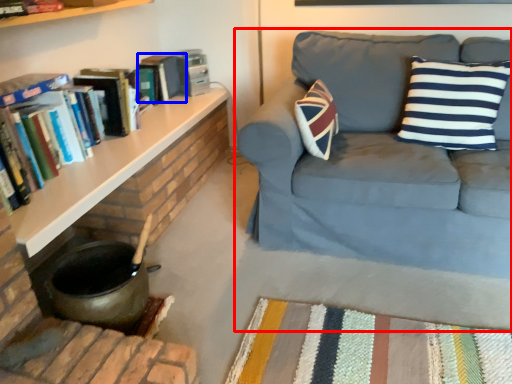
Question: Among these objects, which one is nearest to the camera, studio couch (highlighted by a red box) or paperback book (highlighted by a blue box)?

Choices:
 (A) studio couch
 (B) paperback book

Answer: (A)